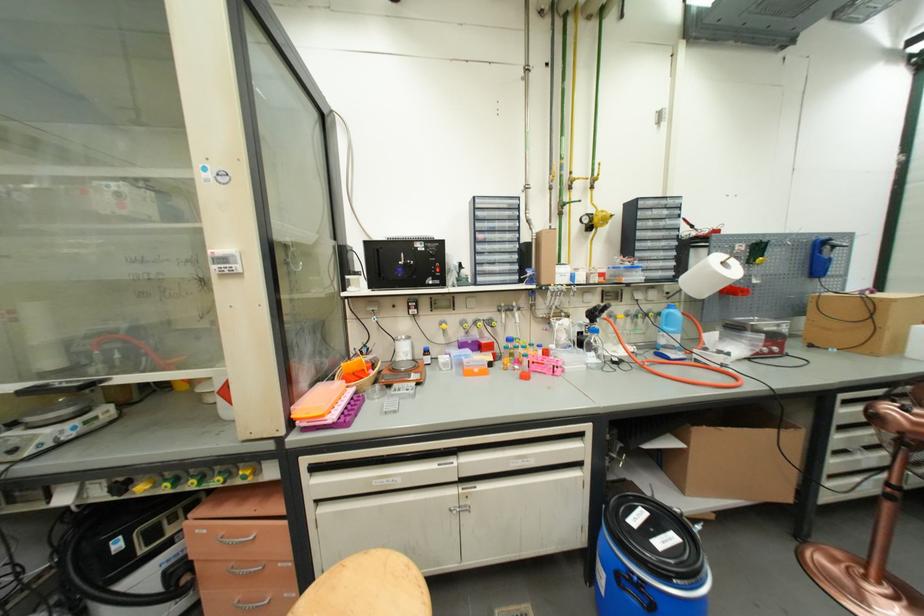
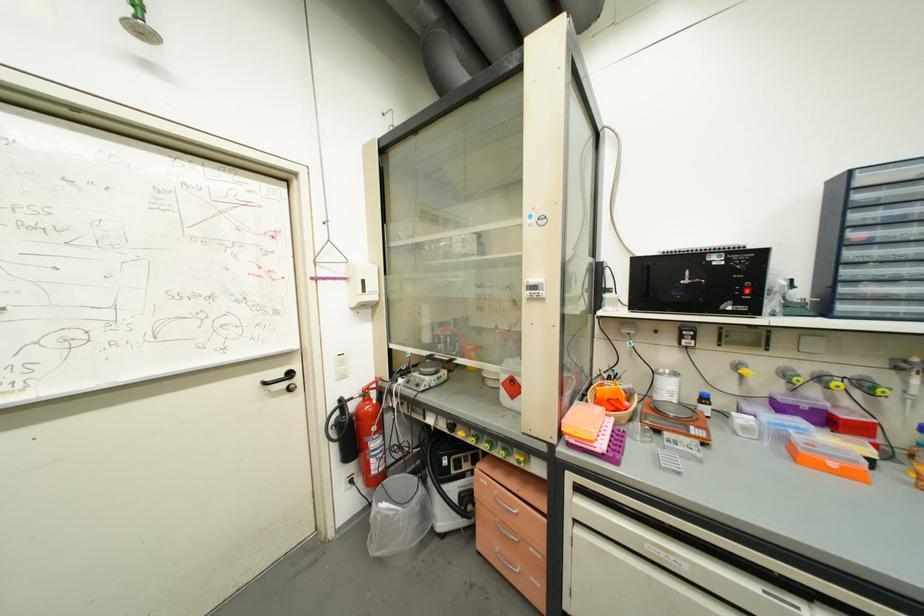
Locate, in the second image, the point that corresponds to the point at 407,262 in the first image.

(688, 282)